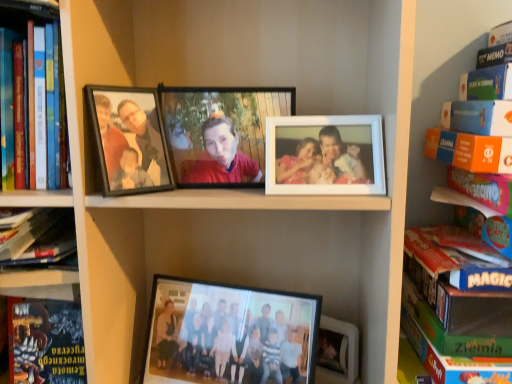
Question: Considering the relative sizes of hardcover book at lower left and hardcover book at left, arranged as the third book when viewed from the left, in the image provided, is hardcover book at lower left thinner than hardcover book at left, arranged as the third book when viewed from the left,?

Choices:
 (A) no
 (B) yes

Answer: (B)

Question: Considering the relative sizes of hardcover book at lower left and hardcover book at left, arranged as the third book when viewed from the left, in the image provided, is hardcover book at lower left taller than hardcover book at left, arranged as the third book when viewed from the left,?

Choices:
 (A) no
 (B) yes

Answer: (A)

Question: Can hardcover book at left, arranged as the third book when viewed from the left, be found inside hardcover book at lower left?

Choices:
 (A) no
 (B) yes

Answer: (A)

Question: Does hardcover book at lower left have a smaller size compared to hardcover book at left, arranged as the third book when viewed from the left?

Choices:
 (A) yes
 (B) no

Answer: (A)

Question: Is hardcover book at lower left next to hardcover book at left, arranged as the third book when viewed from the left?

Choices:
 (A) no
 (B) yes

Answer: (A)

Question: Considering the positions of hardcover book at left, acting as the second book starting from the right, and black matte photo frame at upper left, marked as the 1th picture frame in a left-to-right arrangement, in the image, is hardcover book at left, acting as the second book starting from the right, wider or thinner than black matte photo frame at upper left, marked as the 1th picture frame in a left-to-right arrangement,?

Choices:
 (A) thin
 (B) wide

Answer: (B)

Question: Relative to black matte photo frame at upper left, positioned as the second picture frame in right-to-left order, is hardcover book at left, acting as the second book starting from the right, in front or behind?

Choices:
 (A) behind
 (B) front

Answer: (B)

Question: Is point (40, 44) closer or farther from the camera than point (123, 190)?

Choices:
 (A) farther
 (B) closer

Answer: (A)

Question: From a real-world perspective, is hardcover book at left, arranged as the third book when viewed from the left, positioned above or below black matte photo frame at upper left, marked as the 1th picture frame in a left-to-right arrangement?

Choices:
 (A) below
 (B) above

Answer: (B)

Question: From a real-world perspective, is hardcover book at left, the 4th book when ordered from right to left, above or below matte black photo frame at center, arranged as the second picture frame when viewed from the left?

Choices:
 (A) above
 (B) below

Answer: (B)

Question: Does point (17, 251) appear closer or farther from the camera than point (256, 153)?

Choices:
 (A) closer
 (B) farther

Answer: (A)

Question: Is hardcover book at left, marked as the 1th book in a left-to-right arrangement, bigger or smaller than matte black photo frame at center, the first picture frame from the right?

Choices:
 (A) small
 (B) big

Answer: (B)

Question: Considering the positions of hardcover book at left, the 4th book when ordered from right to left, and matte black photo frame at center, arranged as the second picture frame when viewed from the left, in the image, is hardcover book at left, the 4th book when ordered from right to left, taller or shorter than matte black photo frame at center, arranged as the second picture frame when viewed from the left,?

Choices:
 (A) tall
 (B) short

Answer: (B)

Question: Considering their positions, is hardcover book at left, arranged as the third book when viewed from the right, located in front of or behind hardcover book at left, the 4th book when ordered from right to left?

Choices:
 (A) front
 (B) behind

Answer: (A)

Question: Considering the positions of hardcover book at left, the 2th book from the left, and hardcover book at left, the 4th book when ordered from right to left, in the image, is hardcover book at left, the 2th book from the left, taller or shorter than hardcover book at left, the 4th book when ordered from right to left,?

Choices:
 (A) tall
 (B) short

Answer: (A)